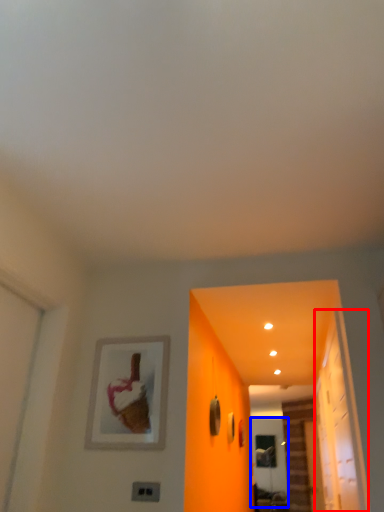
Question: Which object appears farthest to the camera in this image, glass door (highlighted by a red box) or screen door (highlighted by a blue box)?

Choices:
 (A) glass door
 (B) screen door

Answer: (B)